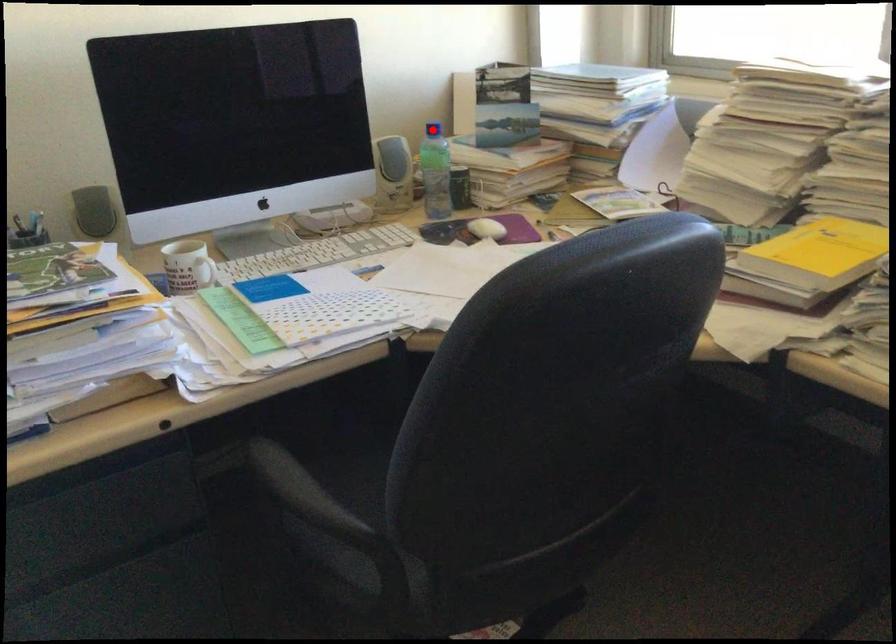
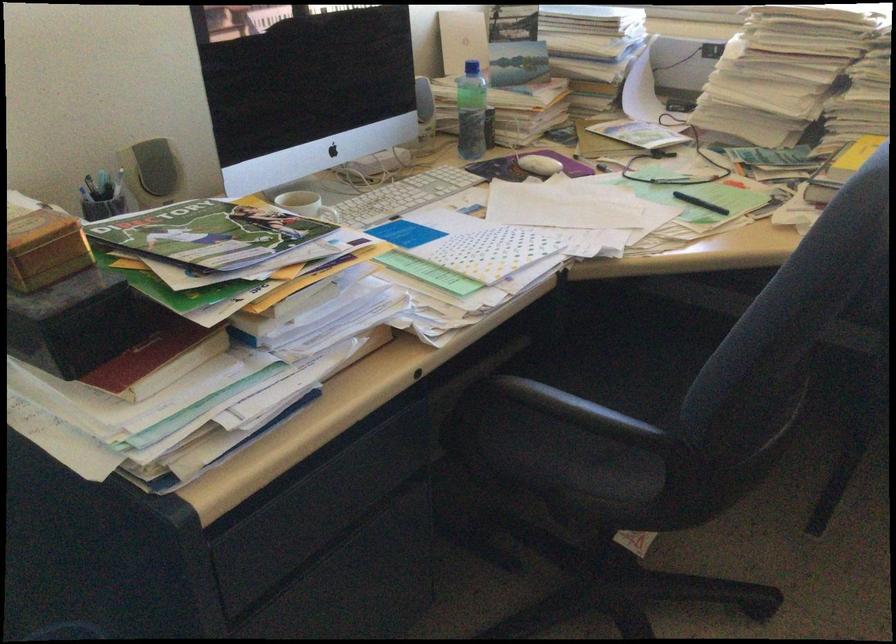
Where in the second image is the point corresponding to the highlighted location from the first image?

(478, 69)